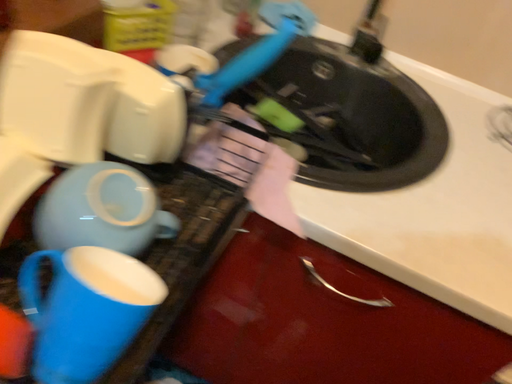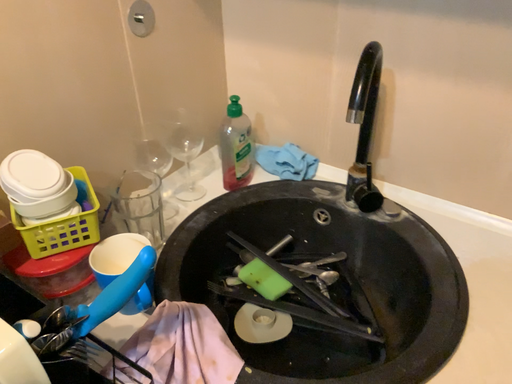
Question: Which way did the camera rotate in the video?

Choices:
 (A) rotated upward
 (B) rotated downward

Answer: (A)